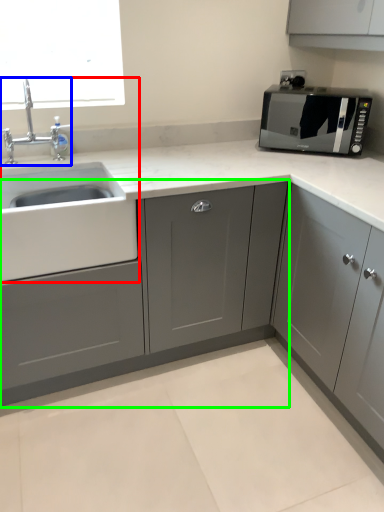
Question: Estimate the real-world distances between objects in this image. Which object is closer to sink (highlighted by a red box), tap (highlighted by a blue box) or cabinetry (highlighted by a green box)?

Choices:
 (A) tap
 (B) cabinetry

Answer: (A)